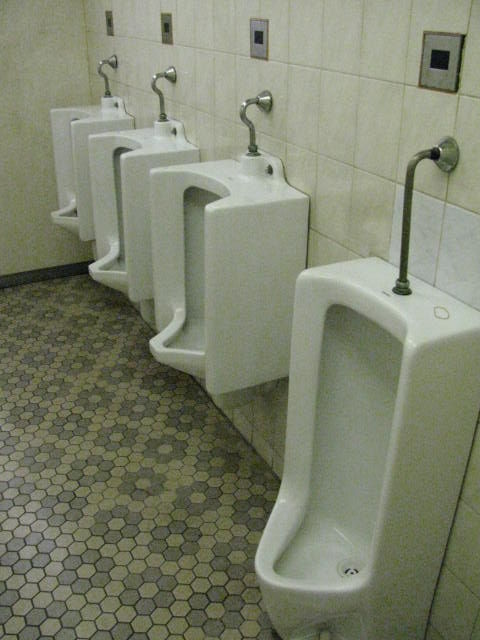
Find the location of a particular element. urinals is located at coordinates (410, 315), (241, 209), (152, 150), (87, 114).